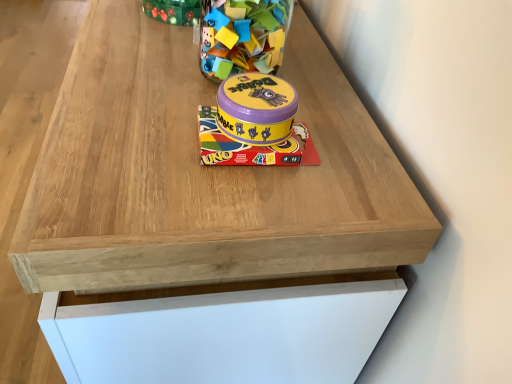
You are a GUI agent. You are given a task and a screenshot of the screen. Output one action in this format:
    pyautogui.click(x=<x>, y=<y>)
    Task: Click on the free space in front of matte purple tin at center, the second toy in the top-to-bottom sequence
    This screenshot has height=384, width=512.
    Given the screenshot: What is the action you would take?
    pyautogui.click(x=237, y=198)